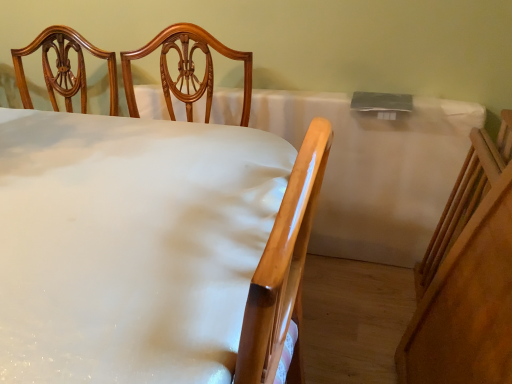
Question: Is white glossy bed at center wider or thinner than white matte tablecloth at center?

Choices:
 (A) thin
 (B) wide

Answer: (B)

Question: From the image's perspective, is white glossy bed at center above or below white matte tablecloth at center?

Choices:
 (A) above
 (B) below

Answer: (B)

Question: Does point (38, 334) appear closer or farther from the camera than point (335, 119)?

Choices:
 (A) farther
 (B) closer

Answer: (B)

Question: Relative to white glossy bed at center, is white matte tablecloth at center in front or behind?

Choices:
 (A) behind
 (B) front

Answer: (A)

Question: Is point (368, 211) positioned closer to the camera than point (129, 337)?

Choices:
 (A) farther
 (B) closer

Answer: (A)

Question: From a real-world perspective, is white matte tablecloth at center above or below white glossy bed at center?

Choices:
 (A) below
 (B) above

Answer: (A)

Question: In terms of size, does white matte tablecloth at center appear bigger or smaller than white glossy bed at center?

Choices:
 (A) small
 (B) big

Answer: (A)